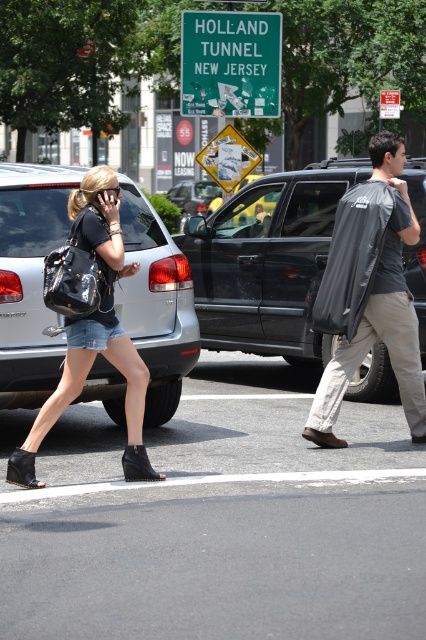
Question: Which of the following is the closest to the observer?

Choices:
 (A) (256, 108)
 (B) (374, 321)

Answer: (B)

Question: Does denim shorts at center appear under black plastic phone at upper left?

Choices:
 (A) yes
 (B) no

Answer: (A)

Question: Is matte black suv at center further to camera compared to black plastic phone at upper left?

Choices:
 (A) no
 (B) yes

Answer: (B)

Question: Which point is closer to the camera?

Choices:
 (A) (354, 276)
 (B) (103, 192)

Answer: (B)

Question: Which point is farther from the camera taking this photo?

Choices:
 (A) (408, 230)
 (B) (184, 241)

Answer: (B)

Question: Does matte black suv at center appear over dark gray fabric bag at center?

Choices:
 (A) no
 (B) yes

Answer: (B)